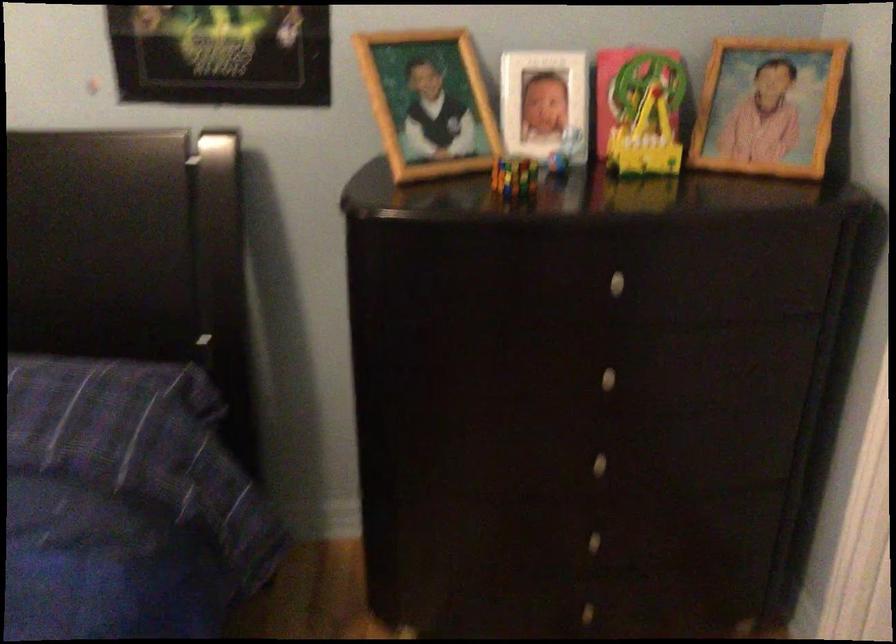
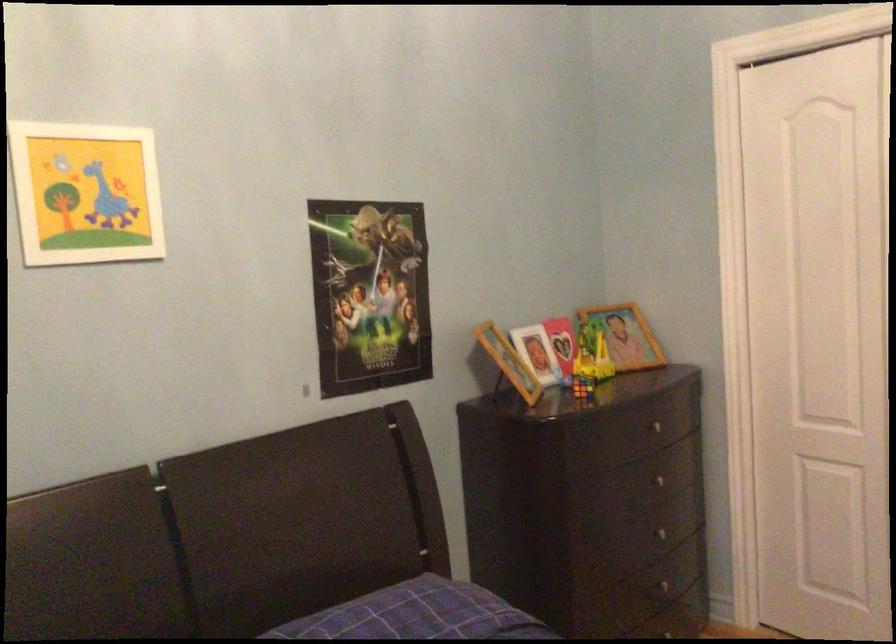
The point at (x=512, y=175) is marked in the first image. Where is the corresponding point in the second image?

(582, 386)